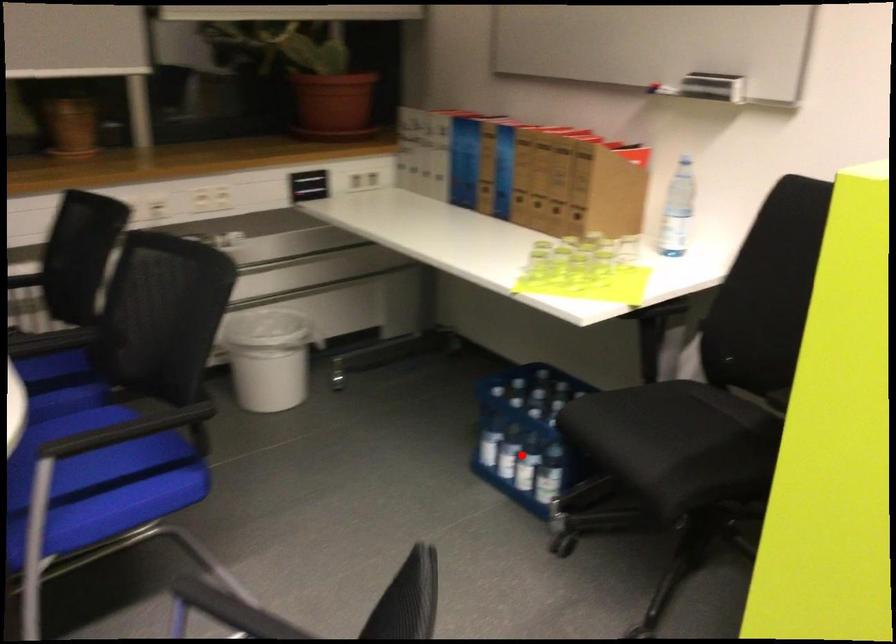
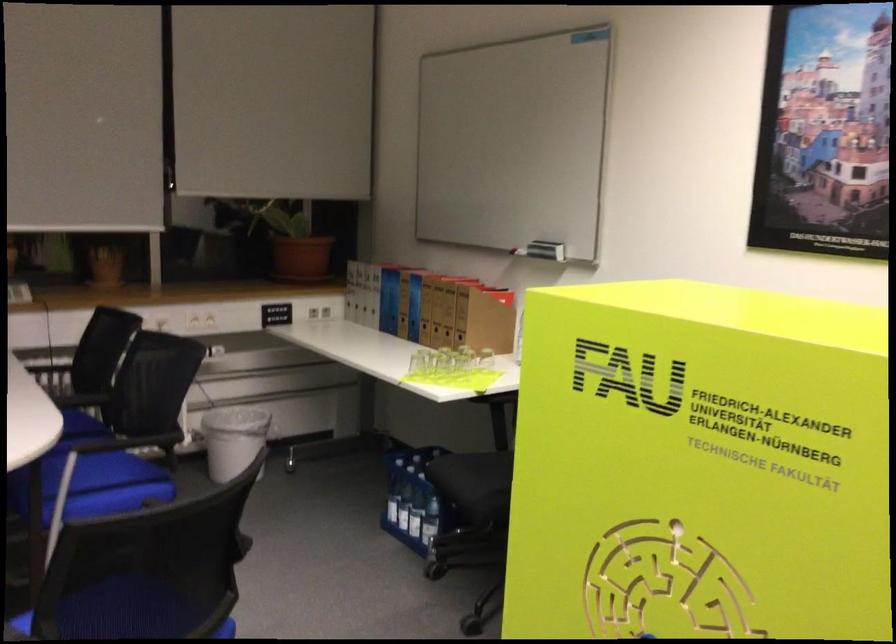
Locate, in the second image, the point that corresponds to the highlighted location in the first image.

(416, 514)